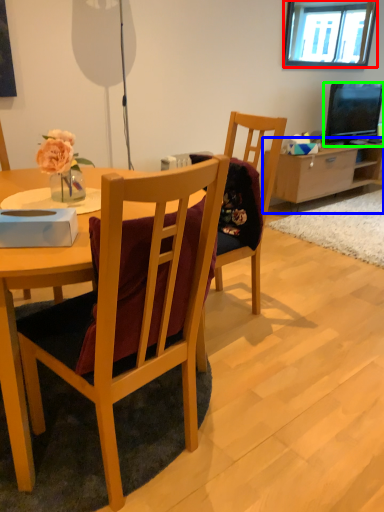
Question: Which object is the closest to the window (highlighted by a red box)? Choose among these: cabinetry (highlighted by a blue box) or television (highlighted by a green box).

Choices:
 (A) cabinetry
 (B) television

Answer: (B)